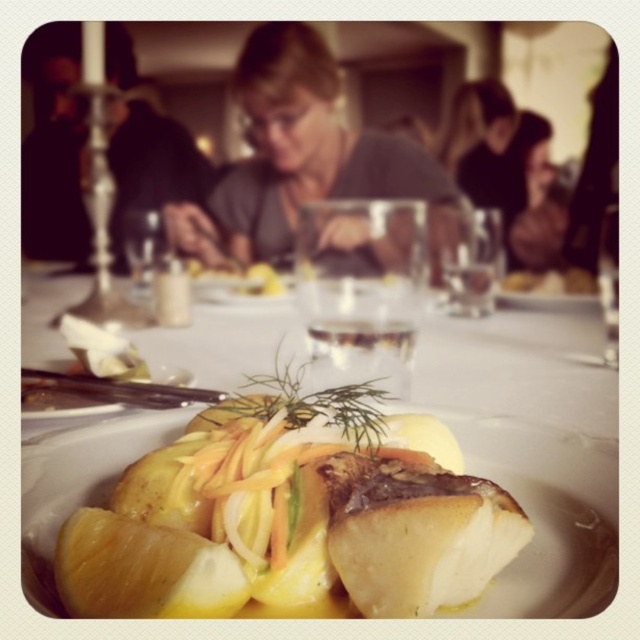
You are a server at the restaurant and need to place the golden glazed fish at center onto the white porcelain plate at center. Based on the size of the plate and the fish, will the fish fit on the plate without falling off?

A: The white porcelain plate at center has a larger size compared to golden glazed fish at center, so the fish will fit on the plate without falling off.

You are a waiter at the restaurant. You need to place a small bowl of herbs next to the gray matte shirt at center. Where should you place the bowl relative to the shirt?

The gray matte shirt at center is located at point (308, 148). You should place the small bowl of herbs next to this coordinate.

You are a diner sitting at the table and want to reach for the golden glazed fish at center and the matte gray sweater at upper center. Which object is taller?

The golden glazed fish at center is not as tall as the matte gray sweater at upper center, so the matte gray sweater at upper center is taller.